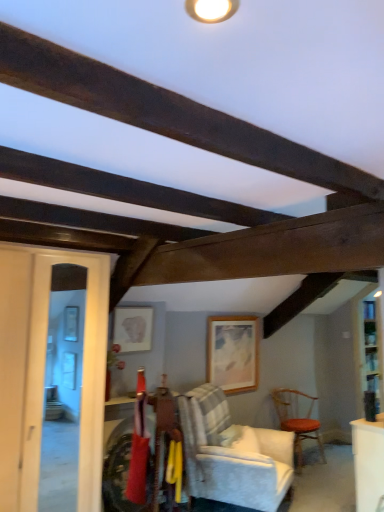
The width and height of the screenshot is (384, 512). What do you see at coordinates (233, 352) in the screenshot?
I see `wooden at center, which is counted as the first picture frame, starting from the back` at bounding box center [233, 352].

In order to face wooden at center, which is counted as the first picture frame, starting from the back, should I rotate leftwards or rightwards?

It's best to rotate right around 5.628 degrees.

Image resolution: width=384 pixels, height=512 pixels. What do you see at coordinates (297, 420) in the screenshot?
I see `wooden textured chair at right, the 2th chair viewed from the left` at bounding box center [297, 420].

Locate an element on the screen. This screenshot has width=384, height=512. dark wood beam at upper center is located at coordinates (167, 113).

The image size is (384, 512). What do you see at coordinates (133, 328) in the screenshot?
I see `matte white picture frame at center, the 1th picture frame viewed from the front` at bounding box center [133, 328].

What is the approximate width of matte white picture frame at center, the 1th picture frame viewed from the front?

matte white picture frame at center, the 1th picture frame viewed from the front, is 2.19 inches in width.

Describe the element at coordinates (82, 377) in the screenshot. I see `clear glass door at left` at that location.

The height and width of the screenshot is (512, 384). What are the coordinates of `wooden at center, the 2th picture frame from the left` in the screenshot? It's located at (233, 352).

Can you confirm if white upholstered chair at center, which appears as the second chair when viewed from the right, is wider than dark wood beam at upper center?

Correct, the width of white upholstered chair at center, which appears as the second chair when viewed from the right, exceeds that of dark wood beam at upper center.

From a real-world perspective, is white upholstered chair at center, placed as the 1th chair when sorted from left to right, over dark wood beam at upper center?

No, from a real-world perspective, white upholstered chair at center, placed as the 1th chair when sorted from left to right, is not over dark wood beam at upper center

From the image's perspective, is white upholstered chair at center, marked as the first chair in a front-to-back arrangement, under dark wood beam at upper center?

Yes, from the image's perspective, white upholstered chair at center, marked as the first chair in a front-to-back arrangement, is below dark wood beam at upper center.

How many degrees apart are the facing directions of wooden at center, the 2th picture frame from the left, and clear glass door at left?

The facing directions of wooden at center, the 2th picture frame from the left, and clear glass door at left are 0.00565 degrees apart.

Is wooden at center, the 2th picture frame from the left, not near clear glass door at left?

Yes, wooden at center, the 2th picture frame from the left, and clear glass door at left are located far from each other.

Considering the sizes of objects wooden at center, which is counted as the second picture frame, starting from the front, and clear glass door at left in the image provided, who is wider, wooden at center, which is counted as the second picture frame, starting from the front, or clear glass door at left?

wooden at center, which is counted as the second picture frame, starting from the front, is wider.

Which picture frame is the 1st one when counting from the front of the wooden textured chair at right, acting as the 1th chair starting from the back? Please provide its 2D coordinates.

[(233, 352)]

In terms of width, does wooden at center, which is counted as the second picture frame, starting from the front, look wider or thinner when compared to wooden textured chair at right, acting as the 1th chair starting from the back?

In the image, wooden at center, which is counted as the second picture frame, starting from the front, appears to be more narrow than wooden textured chair at right, acting as the 1th chair starting from the back.

Who is taller, wooden at center, the 2th picture frame from the left, or wooden textured chair at right, marked as the second chair in a front-to-back arrangement?

With more height is wooden at center, the 2th picture frame from the left.

Which is more to the right, wooden at center, the first picture frame viewed from the right, or wooden textured chair at right, marked as the second chair in a front-to-back arrangement?

From the viewer's perspective, wooden textured chair at right, marked as the second chair in a front-to-back arrangement, appears more on the right side.

Is wooden textured chair at right, acting as the 1th chair starting from the back, turned away from dark wood beam at upper center?

No, wooden textured chair at right, acting as the 1th chair starting from the back, is not facing away from dark wood beam at upper center.

Is wooden textured chair at right, acting as the 1th chair starting from the back, inside or outside of dark wood beam at upper center?

wooden textured chair at right, acting as the 1th chair starting from the back, is not inside dark wood beam at upper center, it's outside.

Is wooden textured chair at right, acting as the 1th chair starting from the back, far from dark wood beam at upper center?

Indeed, wooden textured chair at right, acting as the 1th chair starting from the back, is not near dark wood beam at upper center.

Is the position of wooden textured chair at right, acting as the 1th chair starting from the back, more distant than that of dark wood beam at upper center?

Yes, wooden textured chair at right, acting as the 1th chair starting from the back, is further from the camera.

Can clear glass door at left be found inside white upholstered chair at center, which ranks as the 2th chair in back-to-front order?

No, clear glass door at left is located outside of white upholstered chair at center, which ranks as the 2th chair in back-to-front order.

From the image's perspective, relative to clear glass door at left, is white upholstered chair at center, which appears as the second chair when viewed from the right, above or below?

Based on their image positions, white upholstered chair at center, which appears as the second chair when viewed from the right, is located beneath clear glass door at left.

Is white upholstered chair at center, which ranks as the 2th chair in back-to-front order, facing towards clear glass door at left?

No, white upholstered chair at center, which ranks as the 2th chair in back-to-front order, is not turned towards clear glass door at left.

Does point (192, 426) come farther from viewer compared to point (97, 482)?

Yes, point (192, 426) is farther from viewer.

Which is less distant, (113,343) or (239,157)?

Clearly, point (113,343) is more distant from the camera than point (239,157).

From the image's perspective, is matte white picture frame at center, which ranks as the first picture frame in left-to-right order, on top of dark wood beam at upper center?

No.

Is matte white picture frame at center, which ranks as the first picture frame in left-to-right order, in contact with dark wood beam at upper center?

matte white picture frame at center, which ranks as the first picture frame in left-to-right order, is not next to dark wood beam at upper center, and they're not touching.

Who is shorter, matte white picture frame at center, which is the 2th picture frame from back to front, or dark wood beam at upper center?

With less height is dark wood beam at upper center.

From a real-world perspective, between white upholstered chair at center, which appears as the second chair when viewed from the right, and wooden textured chair at right, acting as the 1th chair starting from the back, who is vertically lower?

From a 3D spatial view, wooden textured chair at right, acting as the 1th chair starting from the back, is below.

Consider the image. Is white upholstered chair at center, which appears as the second chair when viewed from the right, directly adjacent to wooden textured chair at right, marked as the second chair in a front-to-back arrangement?

No, white upholstered chair at center, which appears as the second chair when viewed from the right, is not beside wooden textured chair at right, marked as the second chair in a front-to-back arrangement.

From their relative heights in the image, would you say white upholstered chair at center, marked as the first chair in a front-to-back arrangement, is taller or shorter than wooden textured chair at right, the 2th chair viewed from the left?

white upholstered chair at center, marked as the first chair in a front-to-back arrangement, is taller than wooden textured chair at right, the 2th chair viewed from the left.

Is wooden textured chair at right, the first chair positioned from the right, a part of white upholstered chair at center, placed as the 1th chair when sorted from left to right?

No, white upholstered chair at center, placed as the 1th chair when sorted from left to right, does not contain wooden textured chair at right, the first chair positioned from the right.

Image resolution: width=384 pixels, height=512 pixels. Identify the location of plank above the white upholstered chair at center, placed as the 1th chair when sorted from left to right (from a real-world perspective). (167, 113).

The image size is (384, 512). In order to click on glass door that is on the left side of wooden at center, the first picture frame viewed from the right in this screenshot , I will do `click(82, 377)`.

Estimate the real-world distances between objects in this image. Which object is closer to wooden textured chair at right, acting as the 1th chair starting from the back, matte red fabric at center or matte white picture frame at center, which ranks as the first picture frame in left-to-right order?

matte white picture frame at center, which ranks as the first picture frame in left-to-right order, is closer to wooden textured chair at right, acting as the 1th chair starting from the back.

Estimate the real-world distances between objects in this image. Which object is further from dark wood beam at upper center, wooden at center, the 2th picture frame from the left, or matte white picture frame at center, marked as the second picture frame in a right-to-left arrangement?

wooden at center, the 2th picture frame from the left, is positioned further to the anchor dark wood beam at upper center.

Estimate the real-world distances between objects in this image. Which object is further from wooden textured chair at right, acting as the 1th chair starting from the back, clear glass door at left or dark wood beam at upper center?

Based on the image, dark wood beam at upper center appears to be further to wooden textured chair at right, acting as the 1th chair starting from the back.

Estimate the real-world distances between objects in this image. Which object is closer to wooden at center, which is counted as the second picture frame, starting from the front, white upholstered chair at center, placed as the 1th chair when sorted from left to right, or matte red fabric at center?

white upholstered chair at center, placed as the 1th chair when sorted from left to right, is closer to wooden at center, which is counted as the second picture frame, starting from the front.

Based on their spatial positions, is wooden at center, which is counted as the second picture frame, starting from the front, or white upholstered chair at center, marked as the first chair in a front-to-back arrangement, closer to clear glass door at left?

white upholstered chair at center, marked as the first chair in a front-to-back arrangement, is positioned closer to the anchor clear glass door at left.

Looking at the image, which one is located closer to wooden textured chair at right, marked as the second chair in a front-to-back arrangement, white upholstered chair at center, marked as the first chair in a front-to-back arrangement, or dark wood beam at upper center?

white upholstered chair at center, marked as the first chair in a front-to-back arrangement, is positioned closer to the anchor wooden textured chair at right, marked as the second chair in a front-to-back arrangement.

From the image, which object appears to be farther from wooden at center, the 2th picture frame from the left, matte red fabric at center or clear glass door at left?

clear glass door at left lies further to wooden at center, the 2th picture frame from the left, than the other object.

Considering their positions, is wooden textured chair at right, the 2th chair viewed from the left, positioned closer to wooden at center, which is counted as the second picture frame, starting from the front, than matte white picture frame at center, which ranks as the first picture frame in left-to-right order?

Among the two, wooden textured chair at right, the 2th chair viewed from the left, is located nearer to wooden at center, which is counted as the second picture frame, starting from the front.

Identify the location of laundry between clear glass door at left and white upholstered chair at center, which appears as the second chair when viewed from the right, in the horizontal direction. The height and width of the screenshot is (512, 384). (138, 455).

The width and height of the screenshot is (384, 512). In order to click on chair between dark wood beam at upper center and wooden at center, which is counted as the first picture frame, starting from the back, from front to back in this screenshot , I will do `click(232, 455)`.

This screenshot has width=384, height=512. What are the coordinates of `picture frame between dark wood beam at upper center and wooden at center, which is counted as the first picture frame, starting from the back, along the z-axis` in the screenshot? It's located at (133, 328).

Identify the location of glass door between dark wood beam at upper center and matte red fabric at center from front to back. (82, 377).